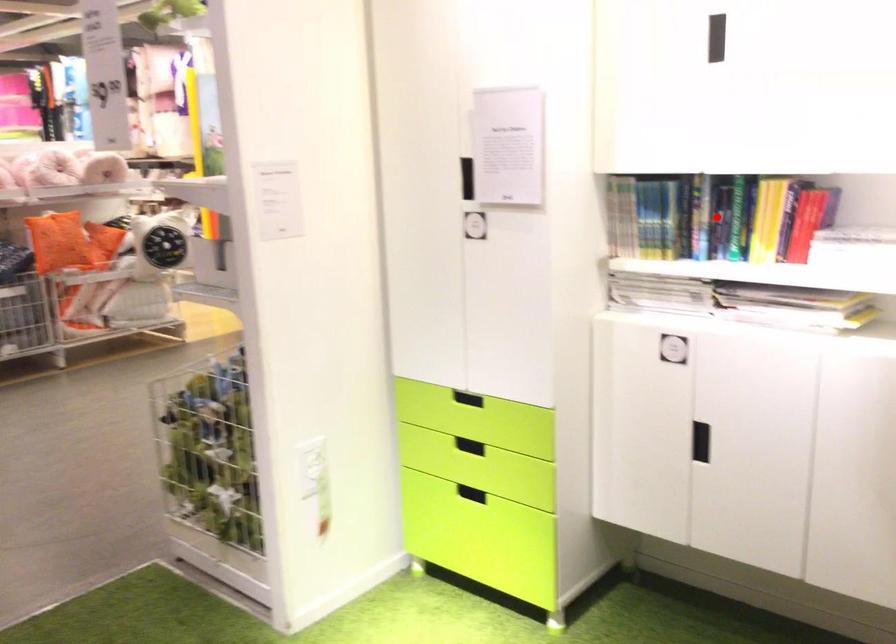
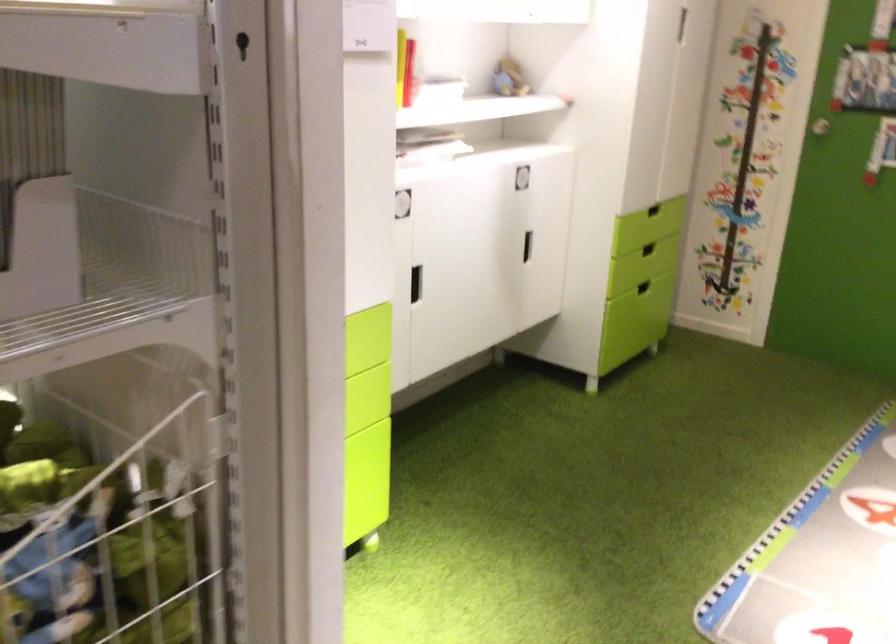
Question: I am providing you with two images of the same scene from different viewpoints. A red point is marked on the first image. At the location where the point appears in image 1, is it still visible in image 2?

Choices:
 (A) Yes
 (B) No

Answer: (B)